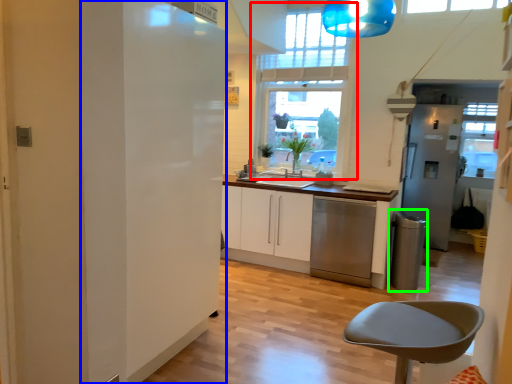
Question: Which object is positioned closest to window (highlighted by a red box)? Select from fridge (highlighted by a blue box) and appliance (highlighted by a green box).

Choices:
 (A) fridge
 (B) appliance

Answer: (B)